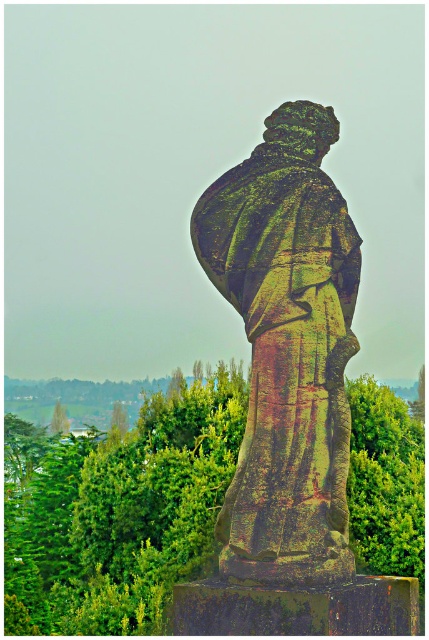
You are standing in front of the stone statue and notice a point at coordinates (118, 513). What object does this point correspond to?

The point at coordinates (118, 513) corresponds to the green leafy tree at center.

You are an artist planning to sketch the rusty stone statue at center from your current position. There is a green leafy tree at center blocking your view. Can you see the entire statue clearly?

Answer: The rusty stone statue at center is behind the green leafy tree at center, so the tree is blocking part of the statue, making it impossible to see the entire statue clearly.

You are standing in a garden and see the green leafy tree at center and the rusty stone statue at center. Which object is located to the left of the other?

The green leafy tree at center is positioned on the left side of rusty stone statue at center.